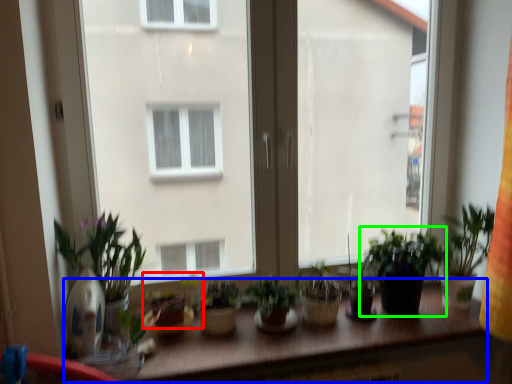
Question: Based on their relative distances, which object is nearer to houseplant (highlighted by a red box)? Choose from table (highlighted by a blue box) and houseplant (highlighted by a green box).

Choices:
 (A) table
 (B) houseplant

Answer: (A)